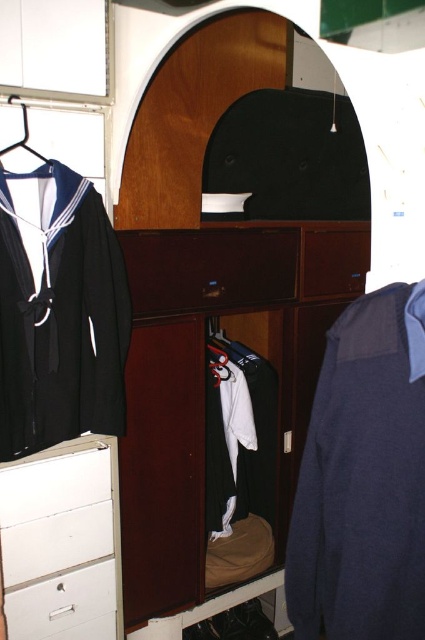
Question: Can you confirm if matte wood dresser at center is bigger than metallic silver hanger at left?

Choices:
 (A) yes
 (B) no

Answer: (A)

Question: Can you confirm if matte wood dresser at center is wider than white plastic drawer at lower left?

Choices:
 (A) no
 (B) yes

Answer: (B)

Question: Which point is farther to the camera?

Choices:
 (A) white plastic drawer at lower left
 (B) matte wood dresser at center
 (C) white matte drawer at lower left
 (D) metallic silver hanger at left

Answer: (B)

Question: Which object is closer to the camera taking this photo?

Choices:
 (A) sailor blue fabric jacket at left
 (B) navy blue sweater at center
 (C) matte wood dresser at center
 (D) metallic silver hanger at left

Answer: (B)

Question: Can you confirm if matte wood dresser at center is thinner than white painted wood file cabinet at lower left?

Choices:
 (A) no
 (B) yes

Answer: (A)

Question: Which point is farther to the camera?

Choices:
 (A) matte wood dresser at center
 (B) navy blue sweater at center

Answer: (A)